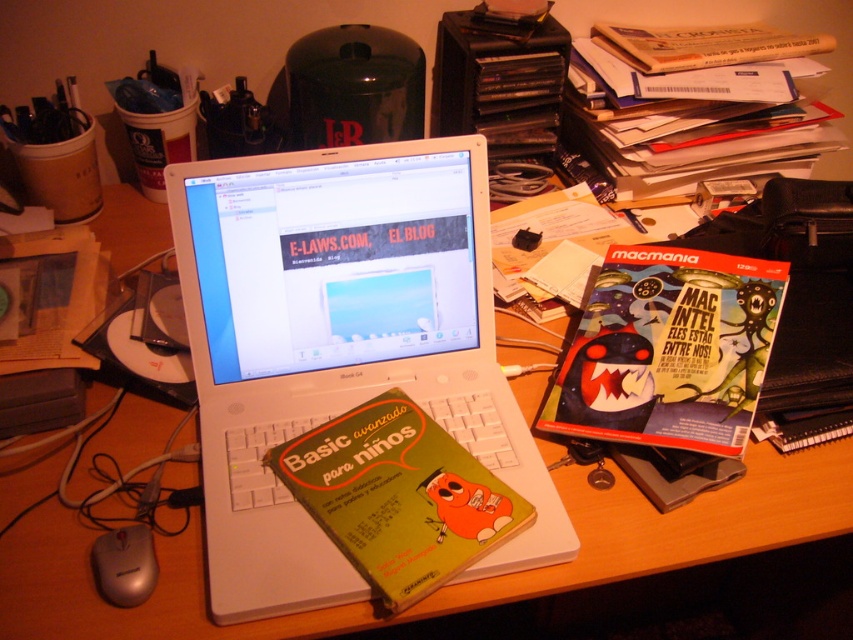
Question: Does wooden at center appear under green matte book at center?

Choices:
 (A) yes
 (B) no

Answer: (B)

Question: Which point is farther to the camera?

Choices:
 (A) (271, 358)
 (B) (640, 136)
 (C) (637, 525)

Answer: (B)

Question: Which point appears closest to the camera in this image?

Choices:
 (A) (94, 552)
 (B) (358, 568)

Answer: (B)

Question: Is white plastic laptop at center to the right of wooden at center from the viewer's perspective?

Choices:
 (A) no
 (B) yes

Answer: (A)

Question: Is wooden at center thinner than green matte book at center?

Choices:
 (A) yes
 (B) no

Answer: (B)

Question: Among these points, which one is nearest to the camera?

Choices:
 (A) (119, 556)
 (B) (729, 394)
 (C) (624, 36)

Answer: (A)